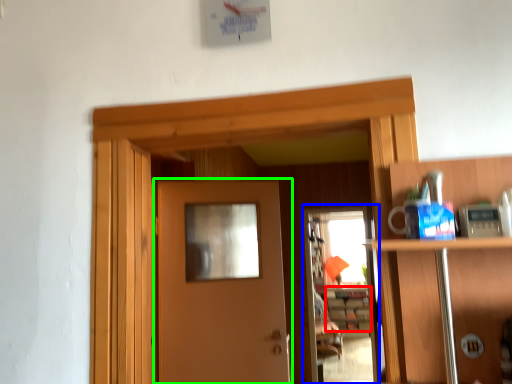
Question: Estimate the real-world distances between objects in this image. Which object is farther from cabinetry (highlighted by a red box), screen door (highlighted by a blue box) or door (highlighted by a green box)?

Choices:
 (A) screen door
 (B) door

Answer: (B)